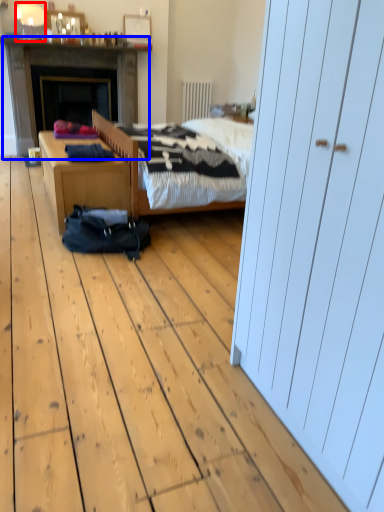
Question: Among these objects, which one is farthest to the camera, lamp (highlighted by a red box) or fireplace (highlighted by a blue box)?

Choices:
 (A) lamp
 (B) fireplace

Answer: (B)